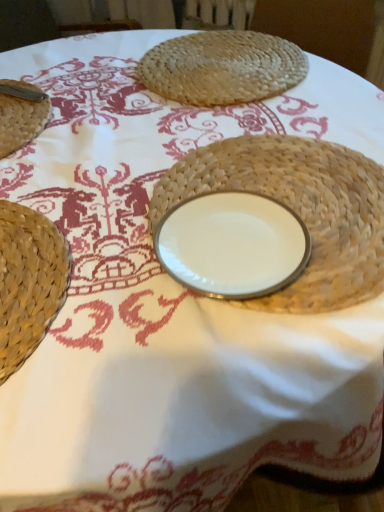
Question: From the image's perspective, is white porcelain plate at center located above or below woven straw placemat at upper center?

Choices:
 (A) above
 (B) below

Answer: (B)

Question: From a real-world perspective, is white porcelain plate at center physically located above or below woven straw placemat at upper center?

Choices:
 (A) above
 (B) below

Answer: (B)

Question: Which of these objects is positioned closest to the white porcelain plate at center?

Choices:
 (A) woven straw placemat at upper center
 (B) woven straw plate at center

Answer: (B)

Question: Which object is positioned closest to the white porcelain plate at center?

Choices:
 (A) woven straw placemat at upper center
 (B) woven straw plate at center

Answer: (B)